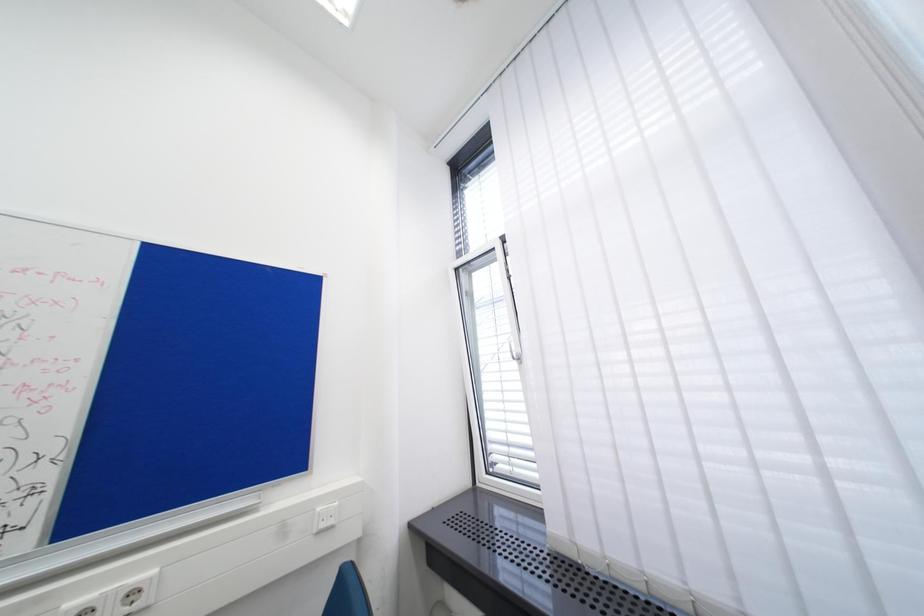
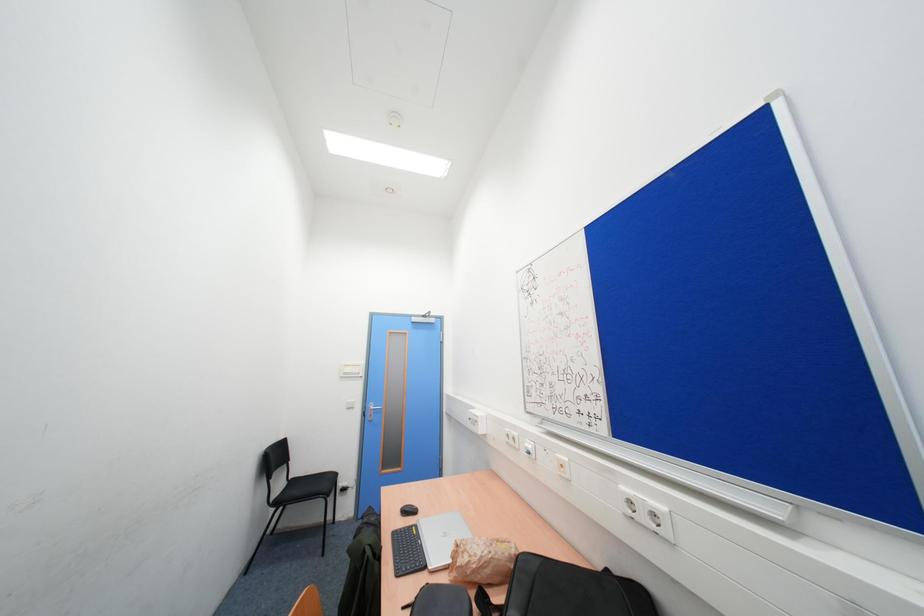
Question: The camera is either moving clockwise (left) or counter-clockwise (right) around the object. The first image is from the beginning of the video and the second image is from the end. Is the camera moving left or right when shooting the video?

Choices:
 (A) Left
 (B) Right

Answer: (B)